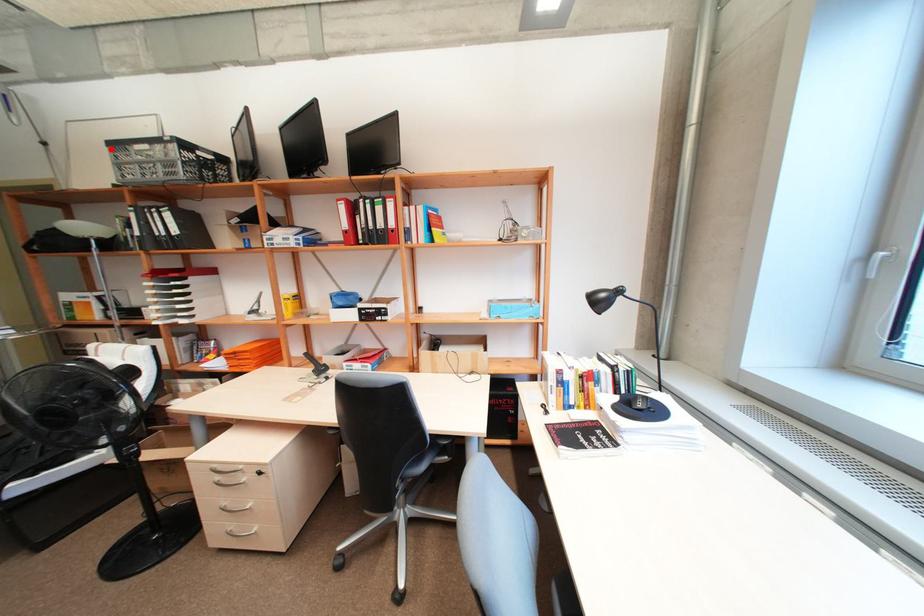
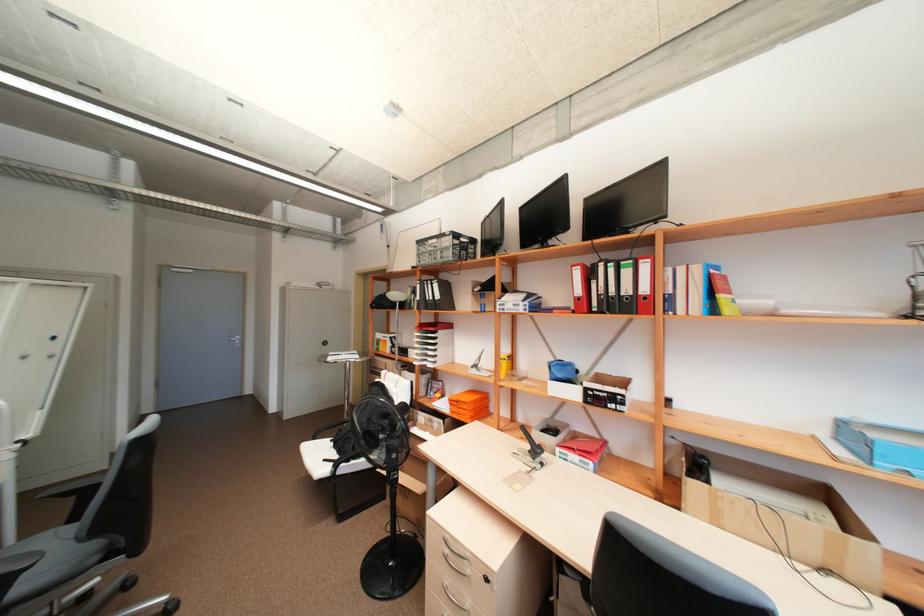
Question: A red point is marked in image1. In image2, is the corresponding 3D point closer to the camera or farther? Reply with the corresponding letter.

Choices:
 (A) The corresponding 3D point is closer.
 (B) The corresponding 3D point is farther.

Answer: (A)